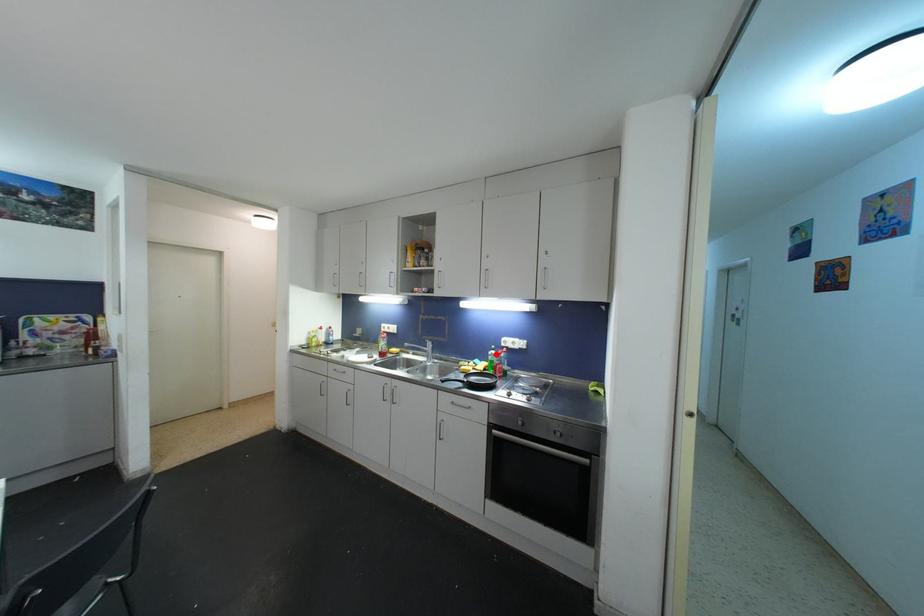
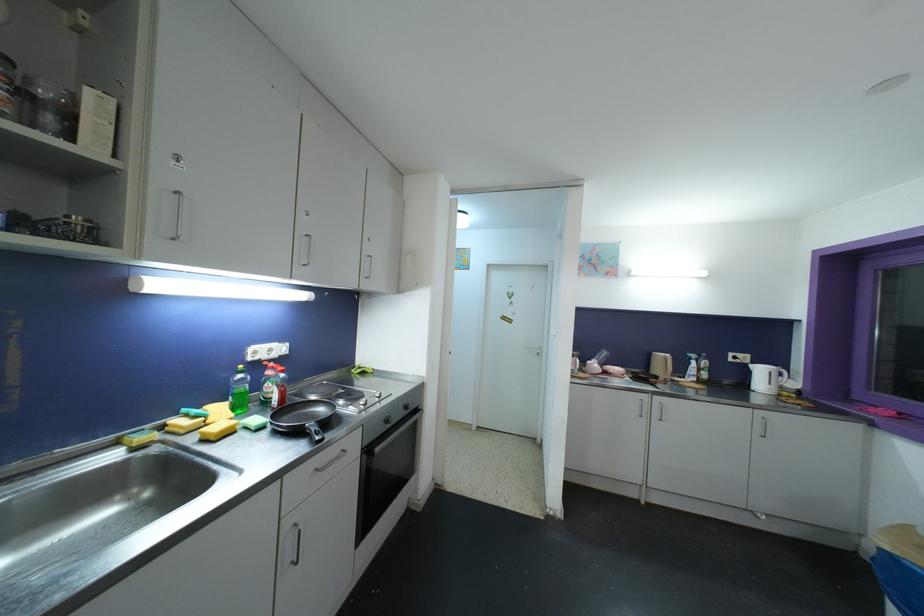
Find the pixel in the second image that matches the highlighted location in the first image.

(244, 379)